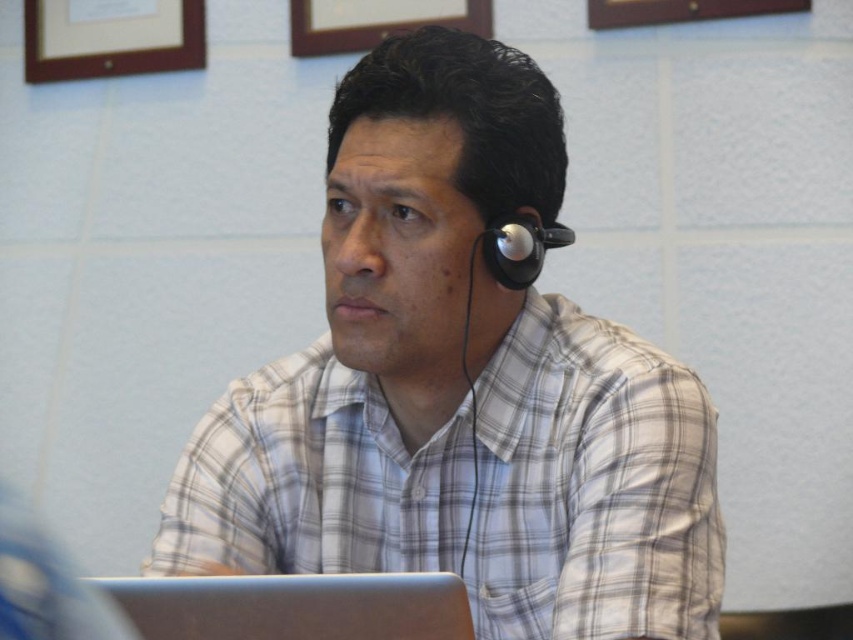
From the picture: You are a delivery person who needs to place a small package between the white checkered shirt at center and the wooden frame at upper left. The package requires at least 5 feet of space to fit. Based on the scene description, will there be enough space?

The distance between the white checkered shirt at center and the wooden frame at upper left is 4.89 feet, which is less than the required 5 feet. Therefore, there is insufficient space to place the package.

Consider the image. Based on the scene description, can you determine the spatial relationship between the white checkered shirt at center and the silver metallic laptop at lower center?

The white checkered shirt at center is to the right of the silver metallic laptop at lower center.

You are a photographer trying to capture the perfect shot of the man in the scene. You notice two points in the image at coordinates point (525, 104) and point (91, 60). To ensure both points are in focus, which point should you focus on first to maximize the chances of both being sharp?

You should focus on point (525, 104) first because it is closer to the camera than point (91, 60). By focusing on the closer point, the farther point will also be within the depth of field, ensuring both are sharp.